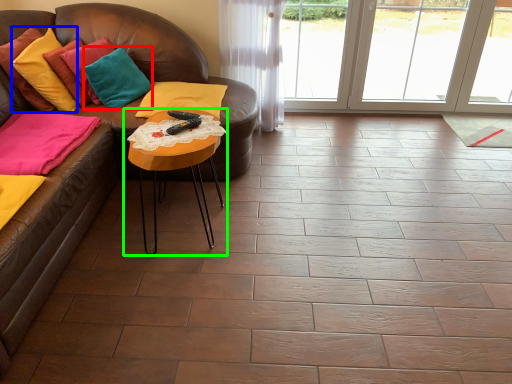
Question: Which object is positioned farthest from pillow (highlighted by a red box)? Select from pillow (highlighted by a blue box) and table (highlighted by a green box).

Choices:
 (A) pillow
 (B) table

Answer: (B)